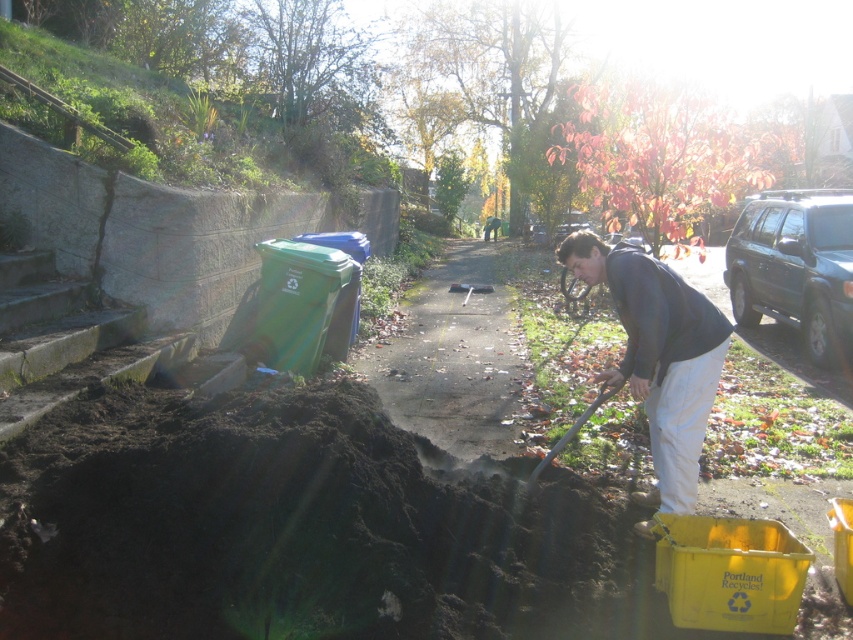
Which is behind, point (694, 420) or point (613, 394)?

The point (613, 394) is more distant.

Based on the photo, between dark gray hoodie at center and wooden shovel at lower center, which one appears on the left side from the viewer's perspective?

From the viewer's perspective, wooden shovel at lower center appears more on the left side.

I want to click on dark gray hoodie at center, so click(659, 356).